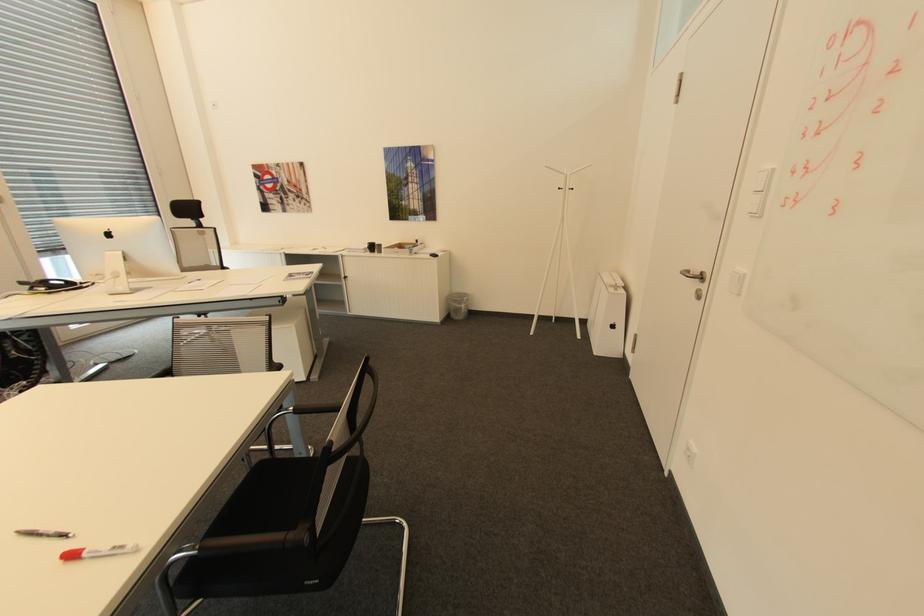
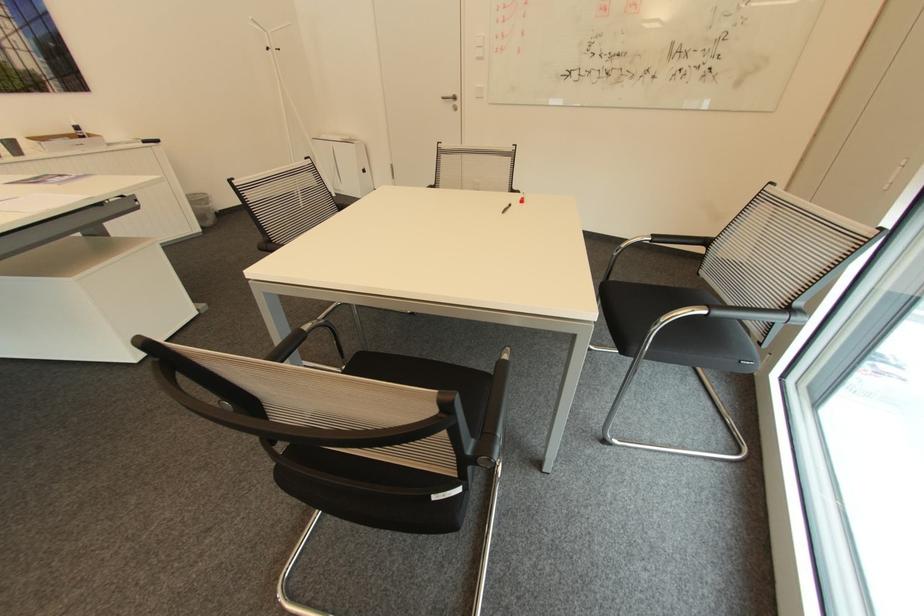
In the second image, find the point that corresponds to point 617,326 in the first image.

(369, 171)